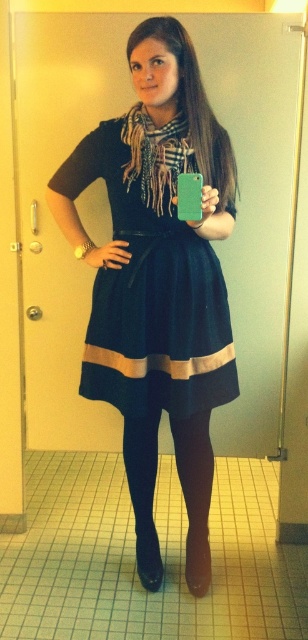
Who is lower down, navy velvet dress at center or plaid wool scarf at center?

navy velvet dress at center

Which is more to the left, navy velvet dress at center or plaid wool scarf at center?

From the viewer's perspective, navy velvet dress at center appears more on the left side.

Between point (129, 372) and point (132, 124), which one is positioned in front?

Point (132, 124) is in front.

You are a GUI agent. You are given a task and a screenshot of the screen. Output one action in this format:
    pyautogui.click(x=<x>, y=<y>)
    Task: Click on the navy velvet dress at center
    
    Given the screenshot: What is the action you would take?
    pyautogui.click(x=149, y=292)

Does navy velvet dress at center appear on the left side of black smooth tights at center?

Correct, you'll find navy velvet dress at center to the left of black smooth tights at center.

Which is in front, point (141, 209) or point (157, 442)?

Point (141, 209) is more forward.

This screenshot has width=308, height=640. In order to click on navy velvet dress at center in this screenshot , I will do `click(149, 292)`.

Image resolution: width=308 pixels, height=640 pixels. What do you see at coordinates (194, 493) in the screenshot?
I see `black smooth tights at center` at bounding box center [194, 493].

Between black smooth tights at center and plaid wool scarf at center, which one appears on the left side from the viewer's perspective?

plaid wool scarf at center is more to the left.

Locate an element on the screen. This screenshot has width=308, height=640. black smooth tights at center is located at coordinates (194, 493).